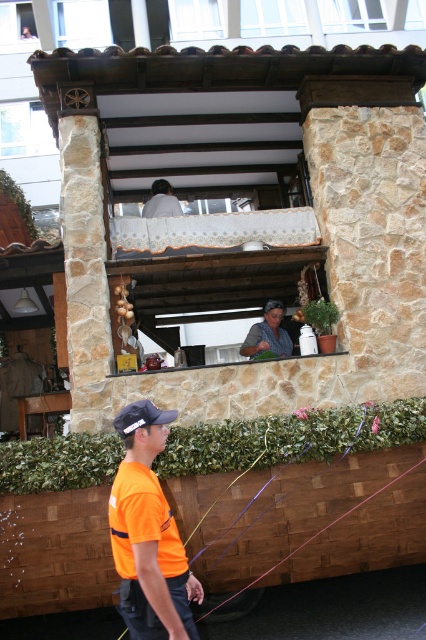
Question: Is orange fabric shirt at lower left closer to camera compared to matte gray shirt at center?

Choices:
 (A) yes
 (B) no

Answer: (A)

Question: Which object is farther from the camera taking this photo?

Choices:
 (A) orange fabric shirt at lower left
 (B) black fabric baseball cap at lower left

Answer: (B)

Question: Can you confirm if orange fabric shirt at lower left is positioned to the left of black fabric baseball cap at lower left?

Choices:
 (A) no
 (B) yes

Answer: (A)

Question: Does matte gray shirt at center appear on the left side of black fabric baseball cap at lower left?

Choices:
 (A) yes
 (B) no

Answer: (B)

Question: Which point appears farthest from the camera in this image?

Choices:
 (A) (172, 410)
 (B) (109, 529)
 (C) (281, 342)

Answer: (C)

Question: Which point is farther from the camera taking this photo?

Choices:
 (A) (137, 470)
 (B) (114, 426)
 (C) (279, 344)

Answer: (C)